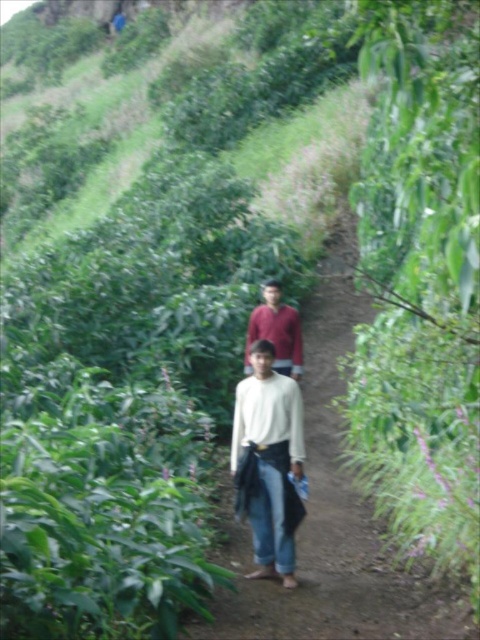
Is point (269, 342) less distant than point (276, 348)?

Yes, it is.

Is point (288, 493) in front of point (249, 364)?

Yes, point (288, 493) is closer to viewer.

Image resolution: width=480 pixels, height=640 pixels. In order to click on white matte shirt at center in this screenshot , I will do `click(269, 442)`.

Between white fabric at center and white matte shirt at center, which one appears on the right side from the viewer's perspective?

white fabric at center is more to the right.

Is white fabric at center further to the viewer compared to white matte shirt at center?

No, white fabric at center is closer to the viewer.

Is point (312, 365) closer to camera compared to point (272, 468)?

No, (312, 365) is behind (272, 468).

I want to click on white fabric at center, so click(333, 509).

Does white fabric at center appear under matte red shirt at center?

No.

Between white fabric at center and matte red shirt at center, which one has less height?

With less height is matte red shirt at center.

This screenshot has height=640, width=480. I want to click on white fabric at center, so click(x=333, y=509).